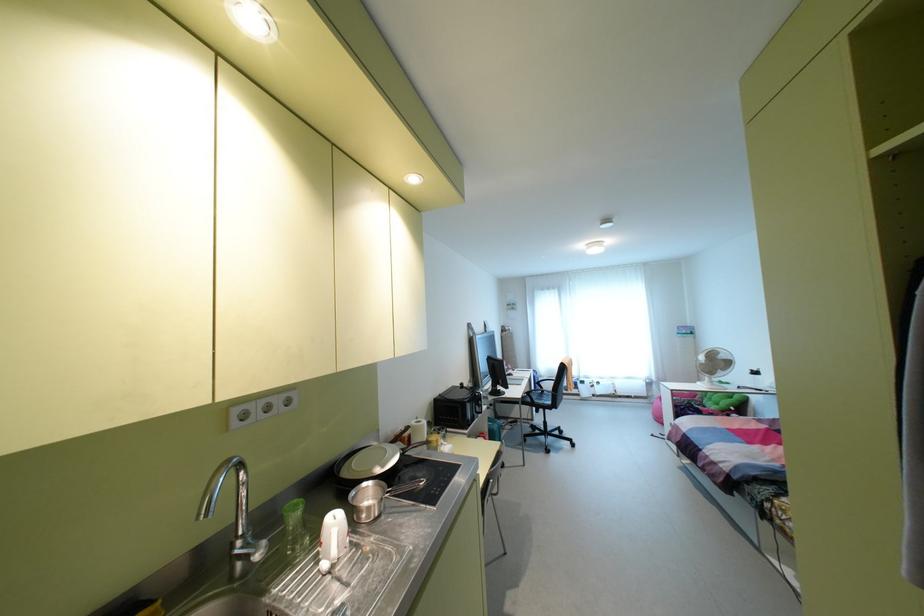
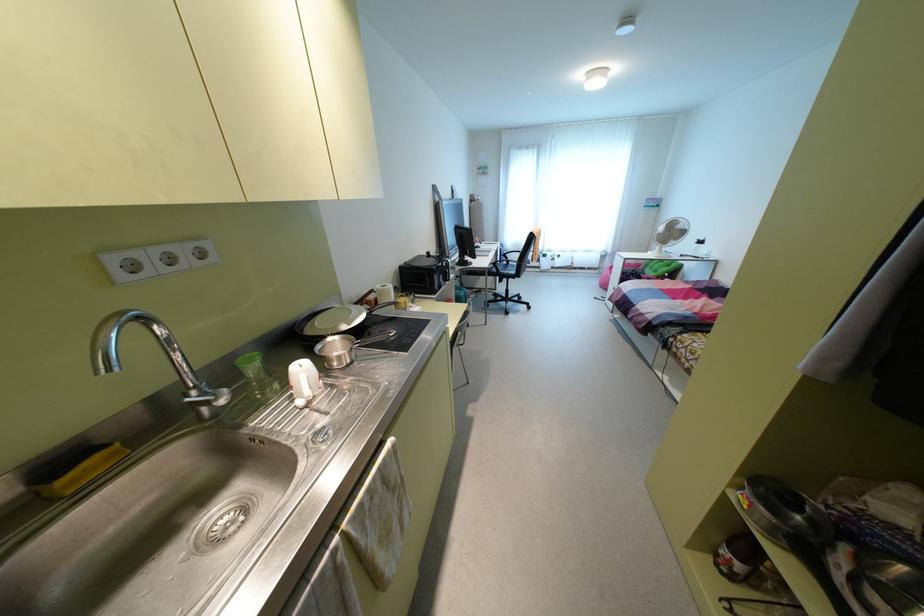
The point at (528, 392) is marked in the first image. Where is the corresponding point in the second image?

(493, 262)